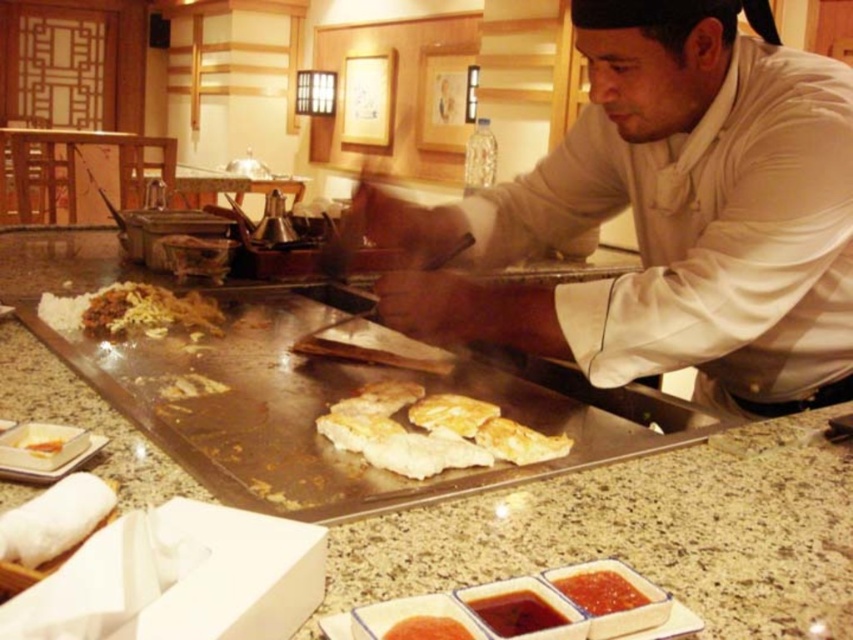
Question: Does golden crispy chicken at center appear over white rice with brown sauce at center-left?

Choices:
 (A) yes
 (B) no

Answer: (B)

Question: Does white rice with brown sauce at center-left appear on the right side of smooth tomato sauce at lower center?

Choices:
 (A) no
 (B) yes

Answer: (A)

Question: Which point appears closest to the camera in this image?

Choices:
 (A) (422, 636)
 (B) (372, 458)

Answer: (A)

Question: Can you confirm if white rice with brown sauce at center-left is positioned above white glossy chicken at center?

Choices:
 (A) yes
 (B) no

Answer: (A)

Question: Which object appears closest to the camera in this image?

Choices:
 (A) white glossy chef coat at center
 (B) white rice with brown sauce at center-left

Answer: (A)

Question: Which object is the closest to the granite countertop at center?

Choices:
 (A) smooth orange sauce at center
 (B) white glossy chicken at center

Answer: (B)